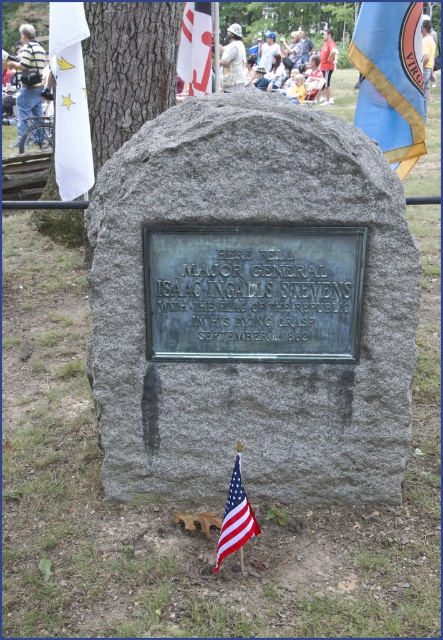
Is point (419, 108) positioned behind point (230, 531)?

Yes, it is behind point (230, 531).

Does blue fabric flag at upper right appear on the left side of american flag at lower center?

No, blue fabric flag at upper right is not to the left of american flag at lower center.

I want to click on blue fabric flag at upper right, so click(x=391, y=80).

Is bronze plaque at center to the left of brown wood tree at upper left from the viewer's perspective?

No, bronze plaque at center is not to the left of brown wood tree at upper left.

What do you see at coordinates (252, 292) in the screenshot?
I see `bronze plaque at center` at bounding box center [252, 292].

The width and height of the screenshot is (443, 640). I want to click on bronze plaque at center, so click(252, 292).

Which is below, gray stone plaque at center or blue fabric flag at upper right?

gray stone plaque at center is lower down.

Between gray stone plaque at center and blue fabric flag at upper right, which one is positioned higher?

blue fabric flag at upper right

Who is more forward, (295, 328) or (397, 36)?

Point (295, 328) is in front.

At what (x,y) coordinates should I click in order to perform the action: click on gray stone plaque at center. Please return your answer as a coordinate pair (x, y). This screenshot has width=443, height=640. Looking at the image, I should click on (255, 360).